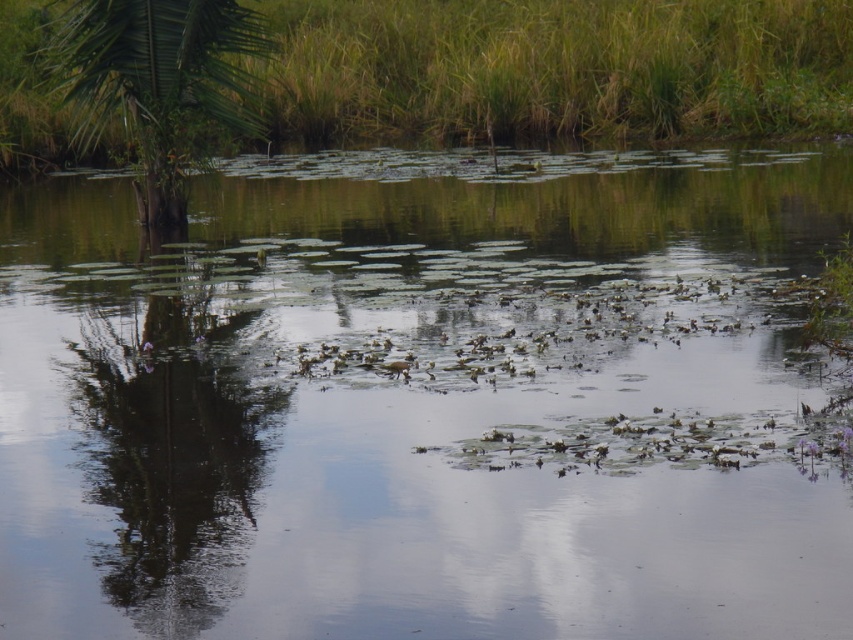
Consider the image. Who is more forward, (567, 84) or (112, 83)?

Point (112, 83) is more forward.

What do you see at coordinates (556, 68) in the screenshot? This screenshot has height=640, width=853. I see `green grass at upper center` at bounding box center [556, 68].

You are a GUI agent. You are given a task and a screenshot of the screen. Output one action in this format:
    pyautogui.click(x=<x>, y=<y>)
    Task: Click on the green grass at upper center
    Image resolution: width=853 pixels, height=640 pixels.
    Given the screenshot: What is the action you would take?
    pyautogui.click(x=556, y=68)